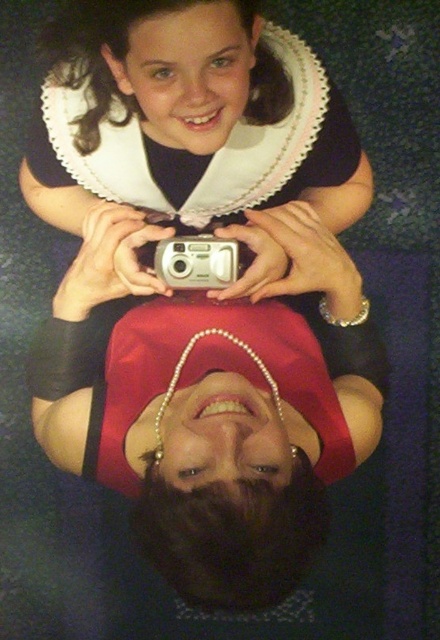
You are an art student analyzing the composition of this upside down scene. Which object is positioned closer to the viewer between the pearl necklace at center and the silver metallic camera at center?

The pearl necklace at center is closer to the viewer than the silver metallic camera at center.

You are a photographer trying to capture a photo of the pearl necklace at center and the silver metallic camera at center. Given that your camera has a maximum focus range of 8 inches, will both objects be in focus?

The pearl necklace at center and silver metallic camera at center are 8.12 inches apart. Since the distance between them exceeds the camera maximum focus range of 8 inches, they will not both be in focus.